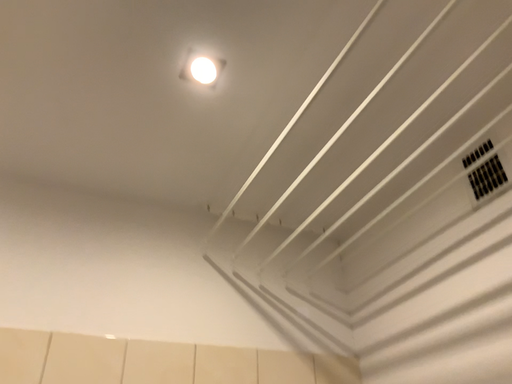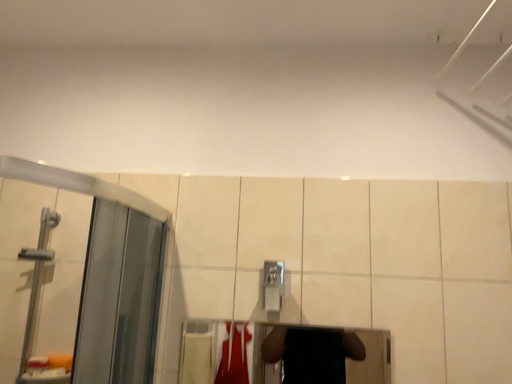
Question: Which way did the camera rotate in the video?

Choices:
 (A) rotated downward
 (B) rotated upward

Answer: (A)